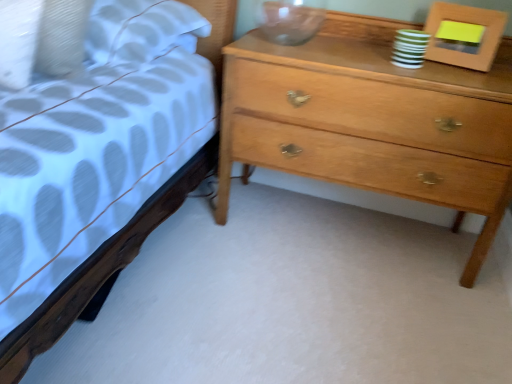
The width and height of the screenshot is (512, 384). I want to click on vacant area to the left of light brown wood chest of drawers at right, so click(198, 252).